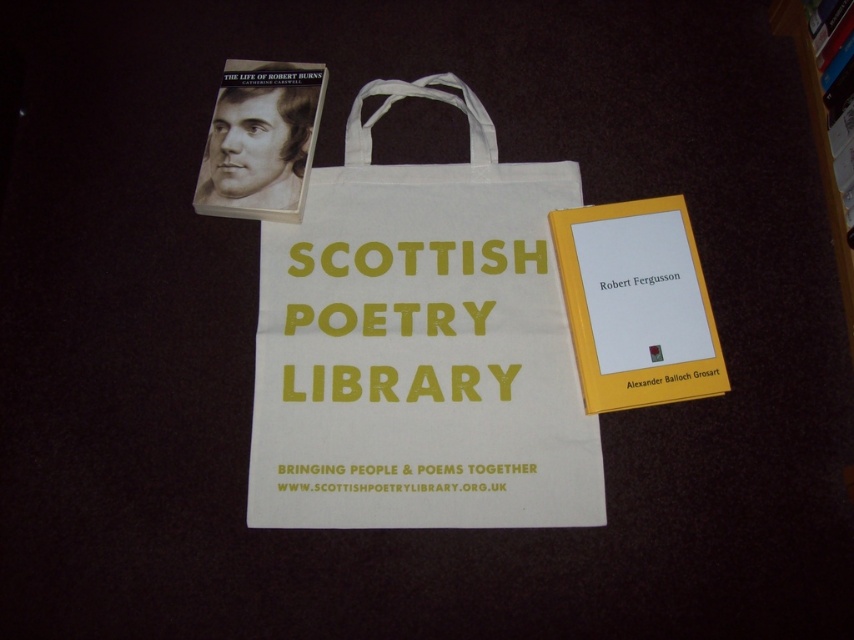
Question: Is yellow paper text at center to the left of wooden bookshelf at upper right from the viewer's perspective?

Choices:
 (A) yes
 (B) no

Answer: (A)

Question: Which object appears closest to the camera in this image?

Choices:
 (A) yellow hardcover book at center
 (B) white cotton tote bag at center
 (C) wooden bookshelf at upper right

Answer: (B)

Question: Can you confirm if yellow hardcover book at center is wider than yellow printed text at center?

Choices:
 (A) no
 (B) yes

Answer: (A)

Question: Which point is closer to the camera?

Choices:
 (A) (528, 266)
 (B) (695, 330)
 (C) (496, 412)

Answer: (B)

Question: Can you confirm if matte paper book at upper left is positioned below wooden bookshelf at upper right?

Choices:
 (A) no
 (B) yes

Answer: (A)

Question: Which point is farther to the camera?

Choices:
 (A) (835, 90)
 (B) (832, 212)
 (C) (524, 440)

Answer: (B)